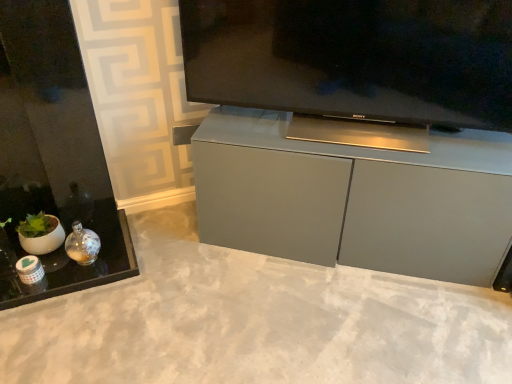
Question: Does matte gray cabinet at center have a smaller size compared to matte gray concrete at center?

Choices:
 (A) yes
 (B) no

Answer: (B)

Question: Could you tell me if matte gray cabinet at center is facing matte gray concrete at center?

Choices:
 (A) no
 (B) yes

Answer: (B)

Question: Does matte gray cabinet at center appear on the left side of matte gray concrete at center?

Choices:
 (A) no
 (B) yes

Answer: (A)

Question: Is matte gray cabinet at center not within matte gray concrete at center?

Choices:
 (A) no
 (B) yes

Answer: (B)

Question: Can you see matte gray cabinet at center touching matte gray concrete at center?

Choices:
 (A) yes
 (B) no

Answer: (B)

Question: Is satin silver television at center wider or thinner than matte gray concrete at center?

Choices:
 (A) thin
 (B) wide

Answer: (A)

Question: Is satin silver television at center bigger or smaller than matte gray concrete at center?

Choices:
 (A) big
 (B) small

Answer: (A)

Question: In the image, is satin silver television at center positioned in front of or behind matte gray concrete at center?

Choices:
 (A) behind
 (B) front

Answer: (A)

Question: Which is correct: satin silver television at center is inside matte gray concrete at center, or outside of it?

Choices:
 (A) inside
 (B) outside

Answer: (B)

Question: Considering the positions of satin silver television at center and matte gray cabinet at center in the image, is satin silver television at center wider or thinner than matte gray cabinet at center?

Choices:
 (A) thin
 (B) wide

Answer: (A)

Question: Considering the positions of point (373, 109) and point (388, 220), is point (373, 109) closer or farther from the camera than point (388, 220)?

Choices:
 (A) closer
 (B) farther

Answer: (A)

Question: Choose the correct answer: Is satin silver television at center inside matte gray cabinet at center or outside it?

Choices:
 (A) outside
 (B) inside

Answer: (A)

Question: From a real-world perspective, relative to matte gray cabinet at center, is satin silver television at center vertically above or below?

Choices:
 (A) below
 (B) above

Answer: (B)

Question: From a real-world perspective, relative to satin silver television at center, is matte gray concrete at center vertically above or below?

Choices:
 (A) above
 (B) below

Answer: (B)

Question: Choose the correct answer: Is matte gray concrete at center inside satin silver television at center or outside it?

Choices:
 (A) inside
 (B) outside

Answer: (B)